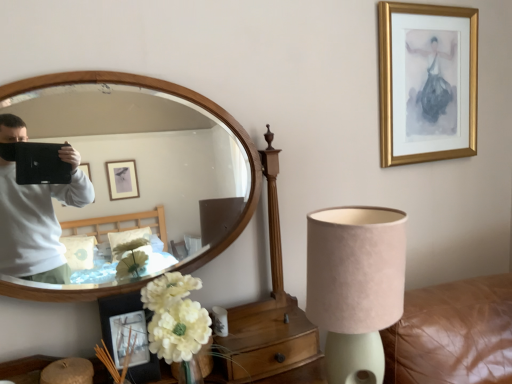
Question: Is wooden mirror at left bigger or smaller than gold framed picture at upper right, the 2th picture frame when ordered from bottom to top?

Choices:
 (A) big
 (B) small

Answer: (A)

Question: From their relative heights in the image, would you say wooden mirror at left is taller or shorter than gold framed picture at upper right, placed as the first picture frame when sorted from top to bottom?

Choices:
 (A) tall
 (B) short

Answer: (A)

Question: Based on their relative distances, which object is farther from the white fabric flower at lower left?

Choices:
 (A) wooden drawer at lower center
 (B) gold framed picture at upper right, which is the 1th picture frame from back to front
 (C) suede lampshade at lower right
 (D) matte black picture frame at lower left, the second picture frame viewed from the top
 (E) wooden mirror at left

Answer: (B)

Question: Considering the real-world distances, which object is farthest from the wooden drawer at lower center?

Choices:
 (A) suede lampshade at lower right
 (B) matte black picture frame at lower left, arranged as the 2th picture frame when viewed from the right
 (C) white fabric flower at lower left
 (D) gold framed picture at upper right, which is the 1th picture frame from back to front
 (E) wooden mirror at left

Answer: (D)